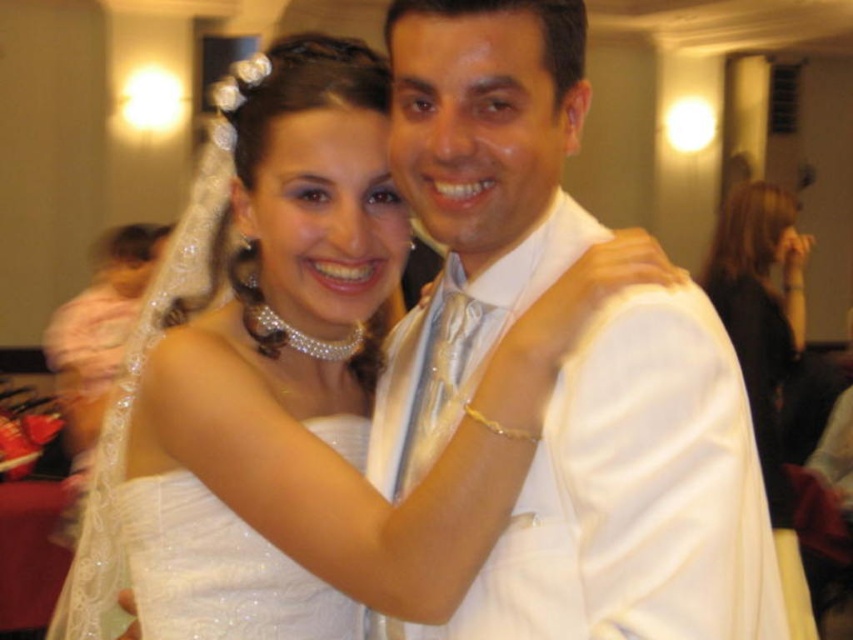
This screenshot has height=640, width=853. Describe the element at coordinates (300, 385) in the screenshot. I see `white satin dress at center` at that location.

Locate an element on the screen. white satin dress at center is located at coordinates (300, 385).

Locate an element on the screen. white satin dress at center is located at coordinates (300, 385).

How distant is white satin shirt at center from satin black dress at center?

white satin shirt at center is 8.32 feet from satin black dress at center.

Looking at this image, which of these two, white satin shirt at center or satin black dress at center, stands taller?

satin black dress at center

Between point (424, 326) and point (755, 214), which one is positioned behind?

The point (755, 214) is behind.

The image size is (853, 640). I want to click on white satin shirt at center, so [x=637, y=496].

Can you confirm if white satin dress at center is smaller than satin black dress at center?

Yes, white satin dress at center is smaller than satin black dress at center.

Is white satin dress at center to the left of satin black dress at center from the viewer's perspective?

Correct, you'll find white satin dress at center to the left of satin black dress at center.

Find the location of `white satin dress at center`. white satin dress at center is located at coordinates tap(300, 385).